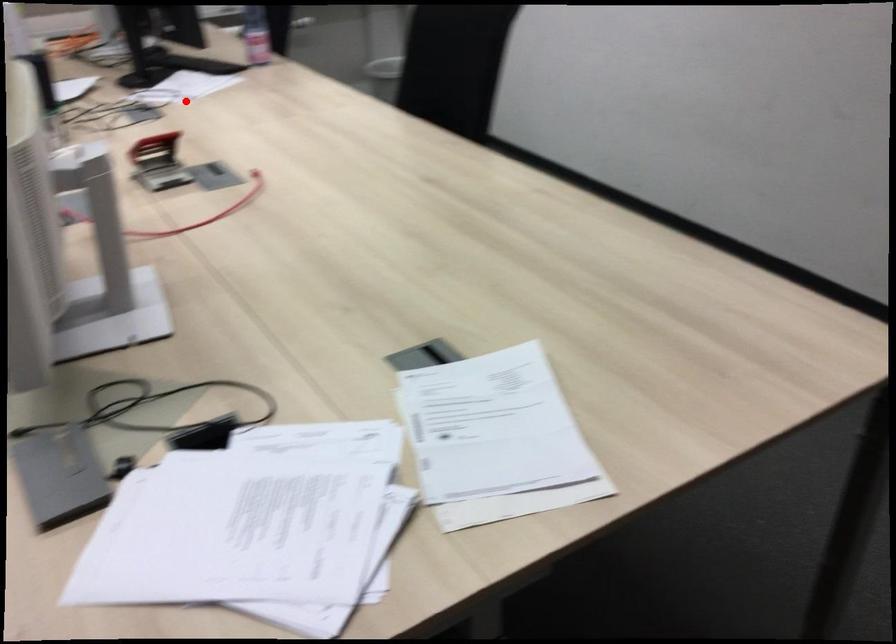
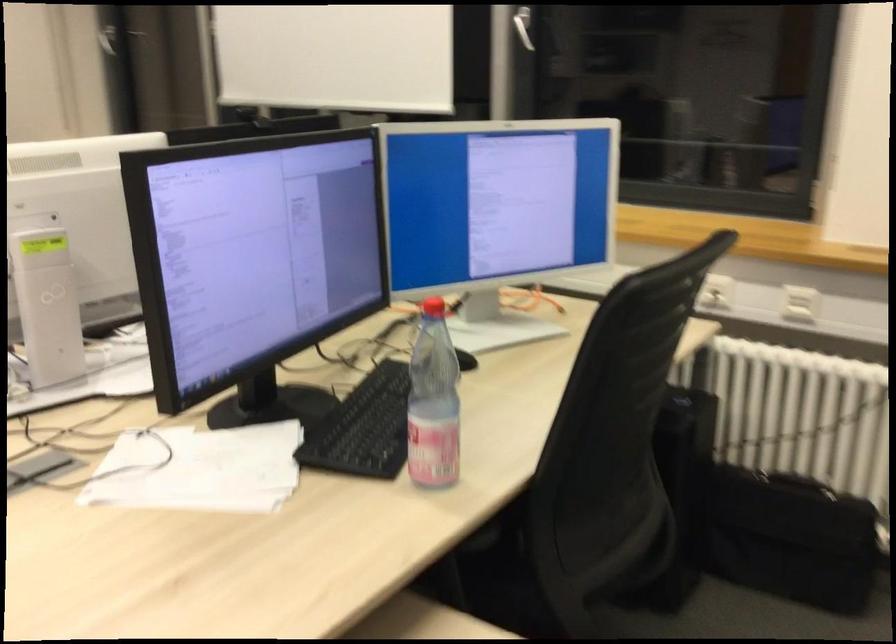
Question: I am providing you with two images of the same scene from different viewpoints. Given a red point in image1, look at the same physical point in image2. Is it:

Choices:
 (A) Closer to the viewpoint
 (B) Farther from the viewpoint

Answer: (A)